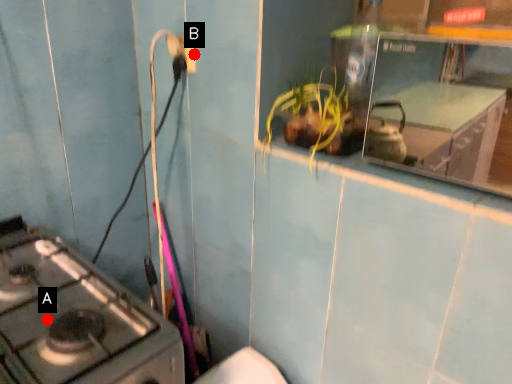
Question: Two points are circled on the image, labeled by A and B beside each circle. Which of the following is the closest to the observer?

Choices:
 (A) A is closer
 (B) B is closer

Answer: (A)